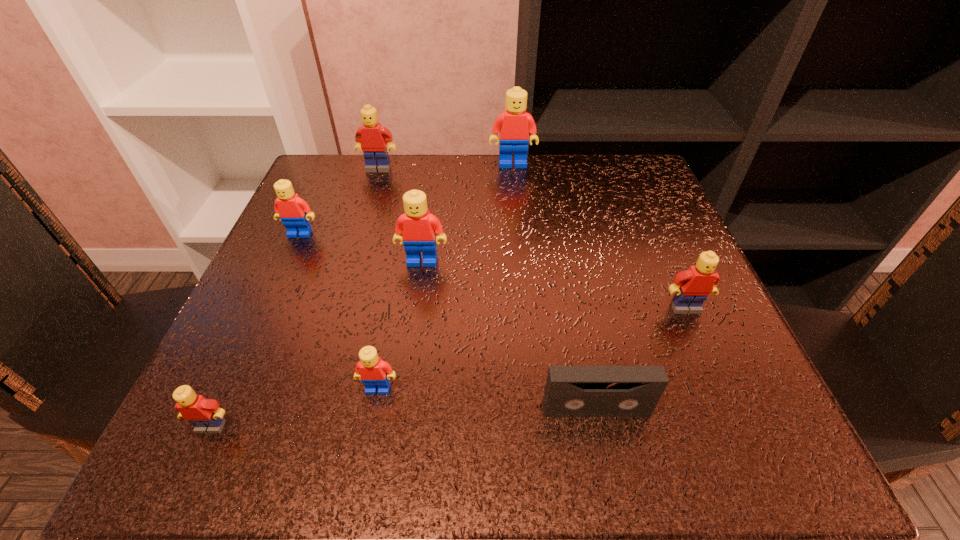
Image resolution: width=960 pixels, height=540 pixels. I want to click on free space between the second Lego from right to left and the second nearest Lego, so click(445, 276).

Locate which object is the fifth closest to the farthest yellow Lego. Please provide its 2D coordinates. Your answer should be formatted as a tuple, i.e. [(x, y)], where the tuple contains the x and y coordinates of a point satisfying the conditions above.

[(206, 415)]

Choose which object is the third nearest neighbor to the second biggest yellow Lego. Please provide its 2D coordinates. Your answer should be formatted as a tuple, i.e. [(x, y)], where the tuple contains the x and y coordinates of a point satisfying the conditions above.

[(373, 371)]

Identify the location of Lego that is the third nearest to the third nearest Lego. (513, 125).

Locate an element on the screen. Image resolution: width=960 pixels, height=540 pixels. Lego that stands as the sixth closest to the third biggest red Lego is located at coordinates (693, 286).

Choose which red Lego is the third nearest neighbor to the second nearest Lego. Please provide its 2D coordinates. Your answer should be formatted as a tuple, i.e. [(x, y)], where the tuple contains the x and y coordinates of a point satisfying the conditions above.

[(513, 125)]

This screenshot has width=960, height=540. I want to click on red Lego that is the second closest to the seventh farthest object, so click(x=419, y=227).

What are the coordinates of `yellow Lego that is the second nearest to the fourth nearest object` in the screenshot? It's located at (206, 415).

The width and height of the screenshot is (960, 540). Identify the location of the third closest yellow Lego to the second Lego from right to left. (206, 415).